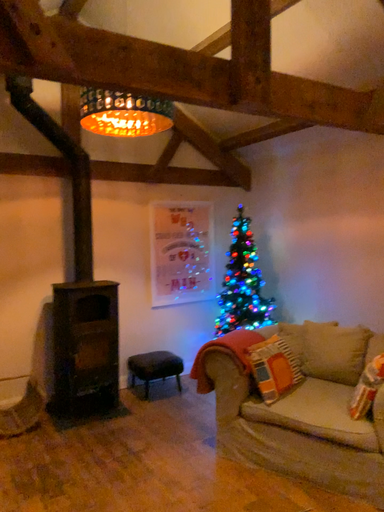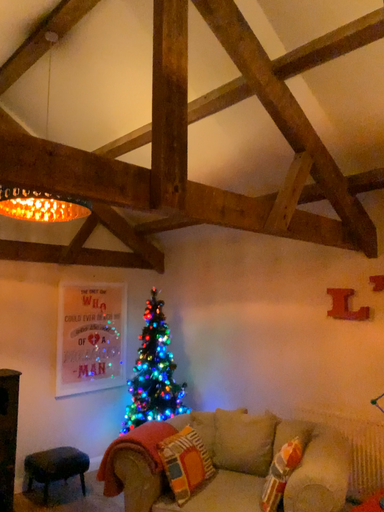
Question: Which way did the camera rotate in the video?

Choices:
 (A) rotated downward
 (B) rotated upward

Answer: (B)